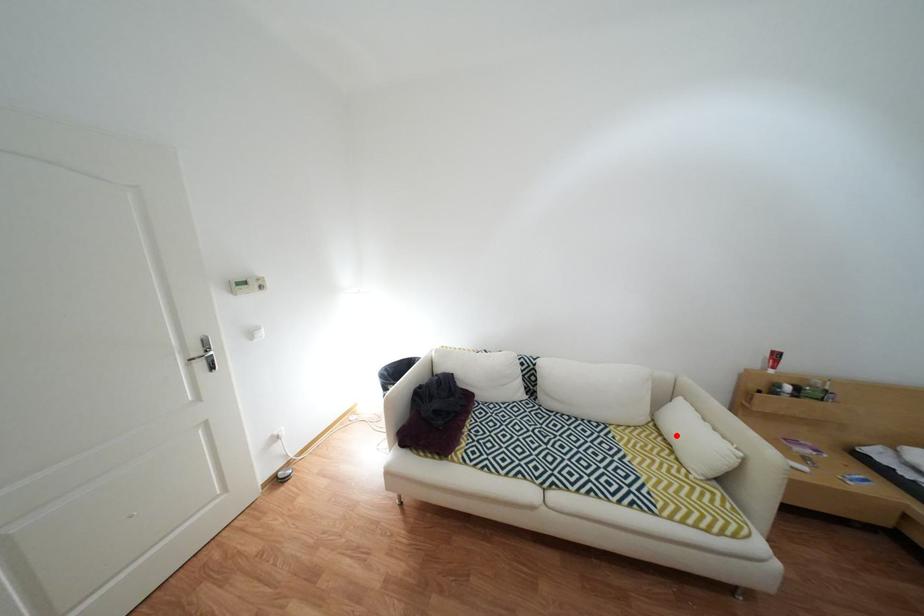
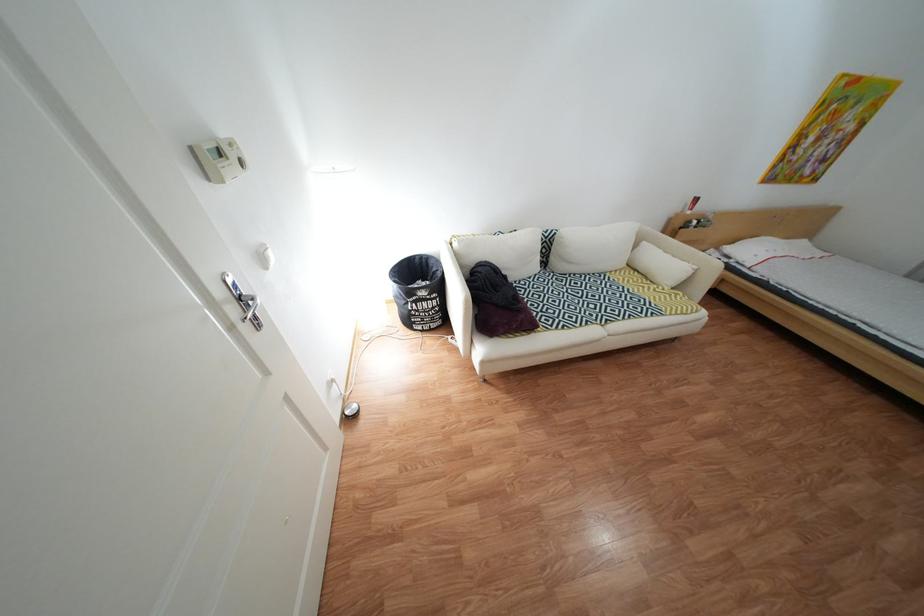
Locate, in the second image, the point that corresponds to the highlighted location in the first image.

(651, 272)